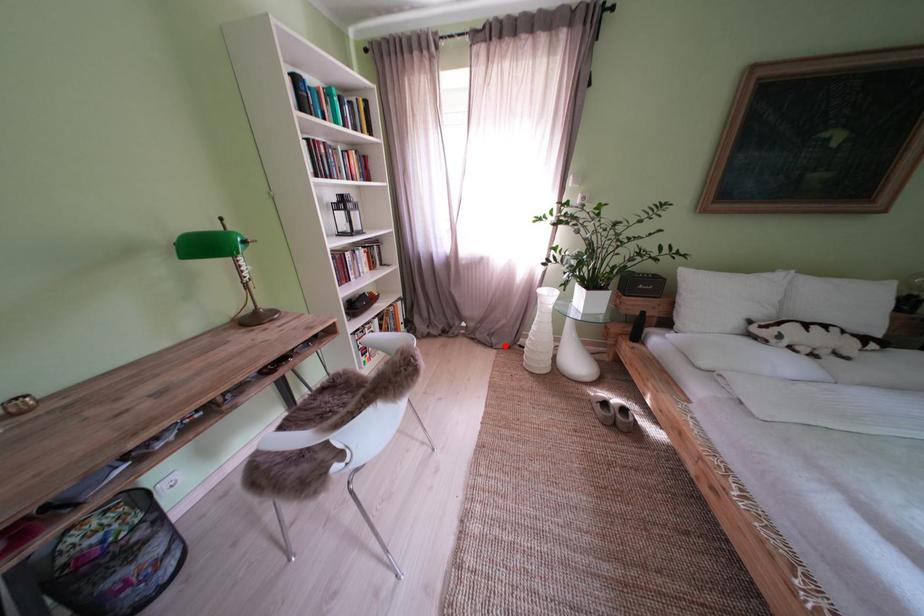
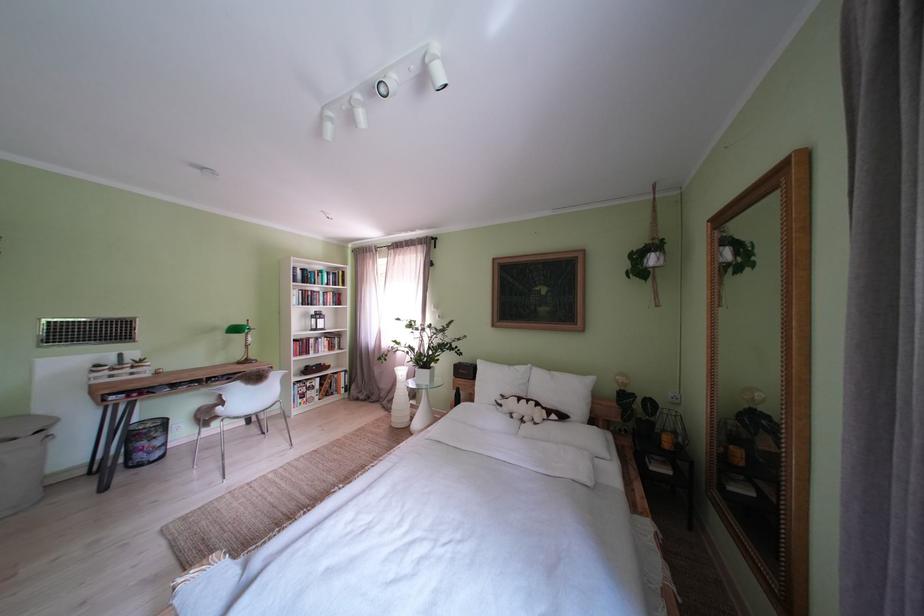
In the second image, find the point that corresponds to the highlighted location in the first image.

(400, 411)